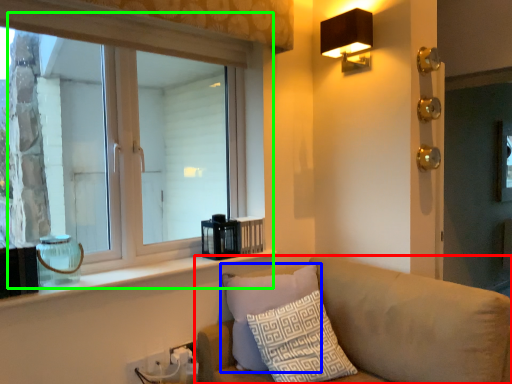
Question: Based on their relative distances, which object is nearer to studio couch (highlighted by a red box)? Choose from pillow (highlighted by a blue box) and window (highlighted by a green box).

Choices:
 (A) pillow
 (B) window

Answer: (A)